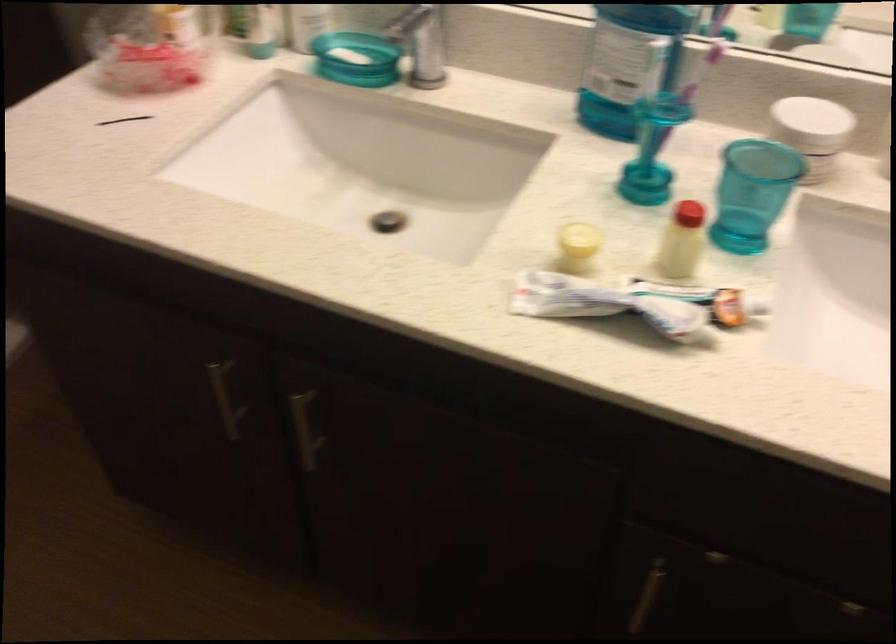
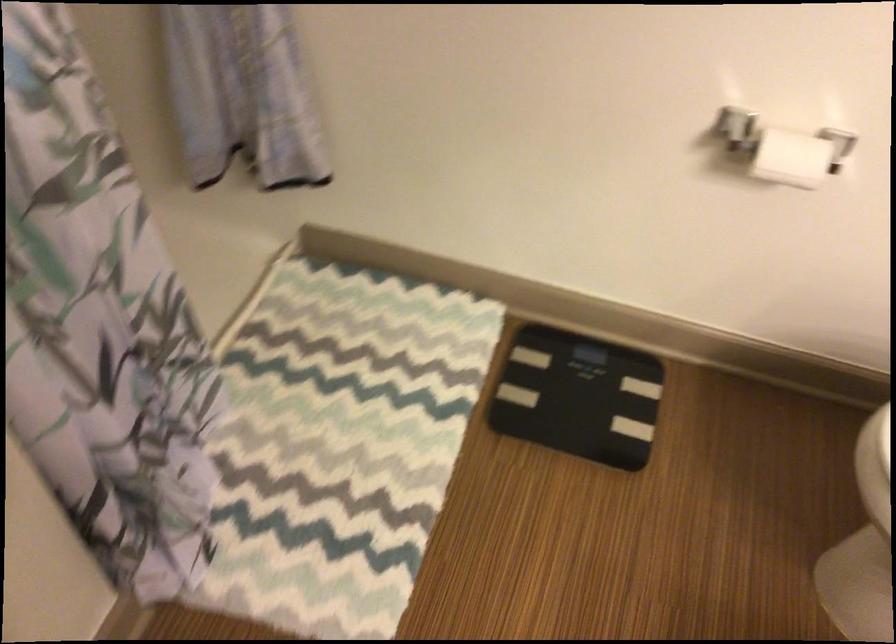
First-person continuous shooting, in which direction is the camera rotating?

The camera rotated toward left-down.